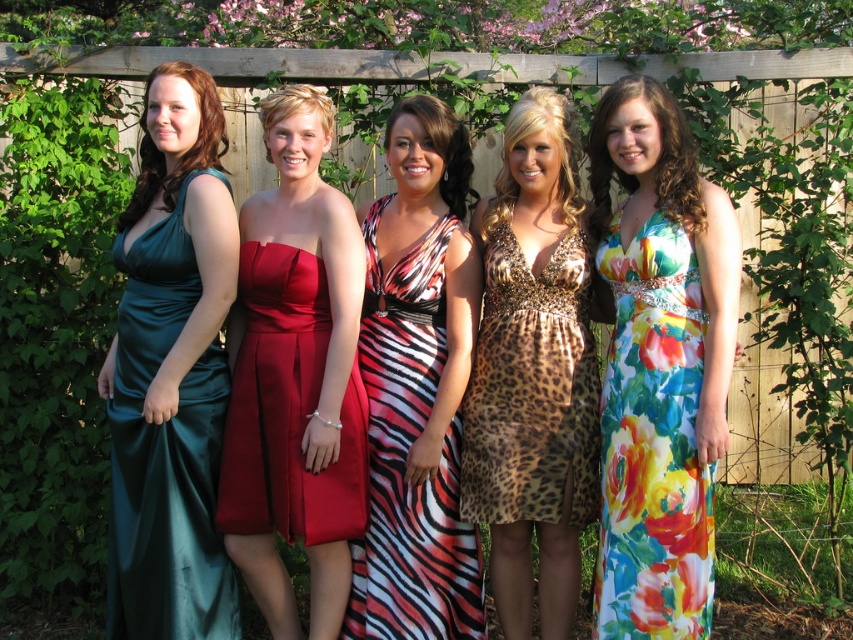
In the scene shown: Does leopard print dress at center have a lesser height compared to satin red dress at center?

No, leopard print dress at center is not shorter than satin red dress at center.

In the scene shown: How far apart are leopard print dress at center and satin red dress at center?

leopard print dress at center and satin red dress at center are 77.70 centimeters apart.

The image size is (853, 640). I want to click on leopard print dress at center, so click(532, 390).

Does floral silk dress at right come behind leopard print dress at center?

No, floral silk dress at right is closer to the viewer.

Is floral silk dress at right above leopard print dress at center?

Incorrect, floral silk dress at right is not positioned above leopard print dress at center.

Is point (668, 515) closer to viewer compared to point (461, 488)?

Yes.

Locate an element on the screen. This screenshot has width=853, height=640. floral silk dress at right is located at coordinates (653, 440).

Who is positioned more to the right, floral silk dress at right or zebra print dress at center?

From the viewer's perspective, floral silk dress at right appears more on the right side.

Can you confirm if floral silk dress at right is positioned above zebra print dress at center?

Indeed, floral silk dress at right is positioned over zebra print dress at center.

Between point (688, 259) and point (457, 634), which one is positioned in front?

Positioned in front is point (688, 259).

Identify the location of floral silk dress at right. The image size is (853, 640). (653, 440).